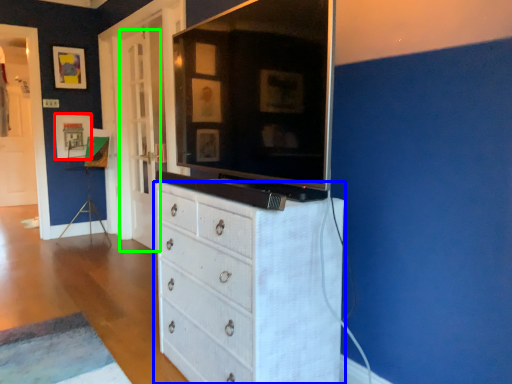
Question: Estimate the real-world distances between objects in this image. Which object is farther from picture frame (highlighted by a red box), chest of drawers (highlighted by a blue box) or door (highlighted by a green box)?

Choices:
 (A) chest of drawers
 (B) door

Answer: (A)